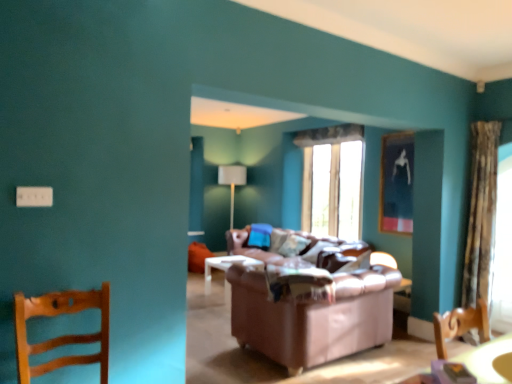
Question: Considering the relative sizes of transparent glass window at center and white fabric lampshade at center in the image provided, is transparent glass window at center bigger than white fabric lampshade at center?

Choices:
 (A) no
 (B) yes

Answer: (A)

Question: Considering the relative positions of transparent glass window at center and white fabric lampshade at center in the image provided, is transparent glass window at center behind white fabric lampshade at center?

Choices:
 (A) no
 (B) yes

Answer: (A)

Question: Can you confirm if transparent glass window at center is taller than white fabric lampshade at center?

Choices:
 (A) no
 (B) yes

Answer: (B)

Question: Can you confirm if transparent glass window at center is positioned to the left of white fabric lampshade at center?

Choices:
 (A) no
 (B) yes

Answer: (A)

Question: Does transparent glass window at center turn towards white fabric lampshade at center?

Choices:
 (A) yes
 (B) no

Answer: (B)

Question: Are transparent glass window at center and white fabric lampshade at center located far from each other?

Choices:
 (A) yes
 (B) no

Answer: (A)

Question: From a real-world perspective, is metallic silver picture frame at upper right located beneath transparent glass window at center?

Choices:
 (A) no
 (B) yes

Answer: (A)

Question: Is metallic silver picture frame at upper right facing towards transparent glass window at center?

Choices:
 (A) no
 (B) yes

Answer: (A)

Question: Are metallic silver picture frame at upper right and transparent glass window at center far apart?

Choices:
 (A) no
 (B) yes

Answer: (A)

Question: Is metallic silver picture frame at upper right facing away from transparent glass window at center?

Choices:
 (A) no
 (B) yes

Answer: (A)

Question: Is metallic silver picture frame at upper right at the left side of transparent glass window at center?

Choices:
 (A) yes
 (B) no

Answer: (B)

Question: Does metallic silver picture frame at upper right touch transparent glass window at center?

Choices:
 (A) no
 (B) yes

Answer: (A)

Question: Is transparent fabric at right completely or partially outside of metallic silver picture frame at upper right?

Choices:
 (A) yes
 (B) no

Answer: (A)